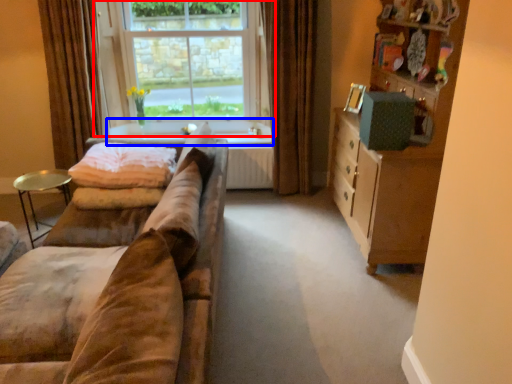
Question: Which of the following is the closest to the observer, window (highlighted by a red box) or window sill (highlighted by a blue box)?

Choices:
 (A) window
 (B) window sill

Answer: (A)